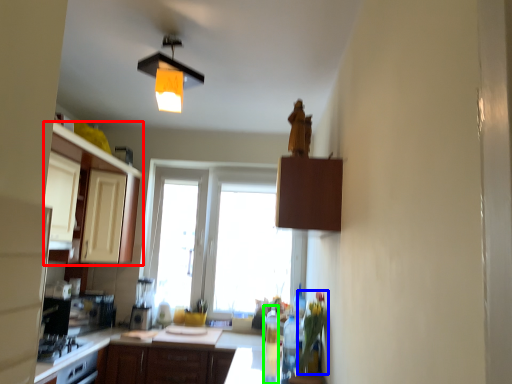
Question: Estimate the real-world distances between objects in this image. Which object is farther from cabinetry (highlighted by a red box), flower (highlighted by a blue box) or bottle (highlighted by a green box)?

Choices:
 (A) flower
 (B) bottle

Answer: (A)